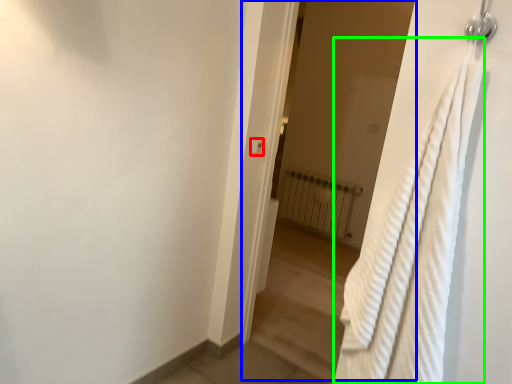
Question: Which object is positioned farthest from light switch (highlighted by a red box)? Select from screen door (highlighted by a blue box) and bath towel (highlighted by a green box).

Choices:
 (A) screen door
 (B) bath towel

Answer: (A)